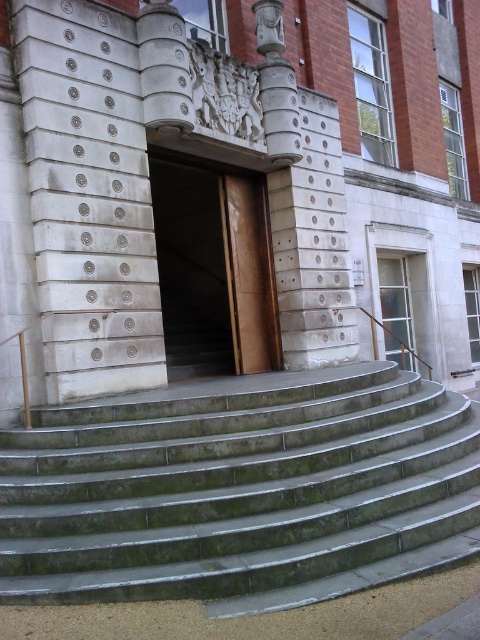
Is point (377, 394) closer to camera compared to point (187, 220)?

Yes, it is.

In the scene shown: Who is taller, green marble stairs at center or brown wooden door at center?

brown wooden door at center

Is point (136, 413) positioned behind point (213, 353)?

No.

I want to click on green marble stairs at center, so click(x=240, y=490).